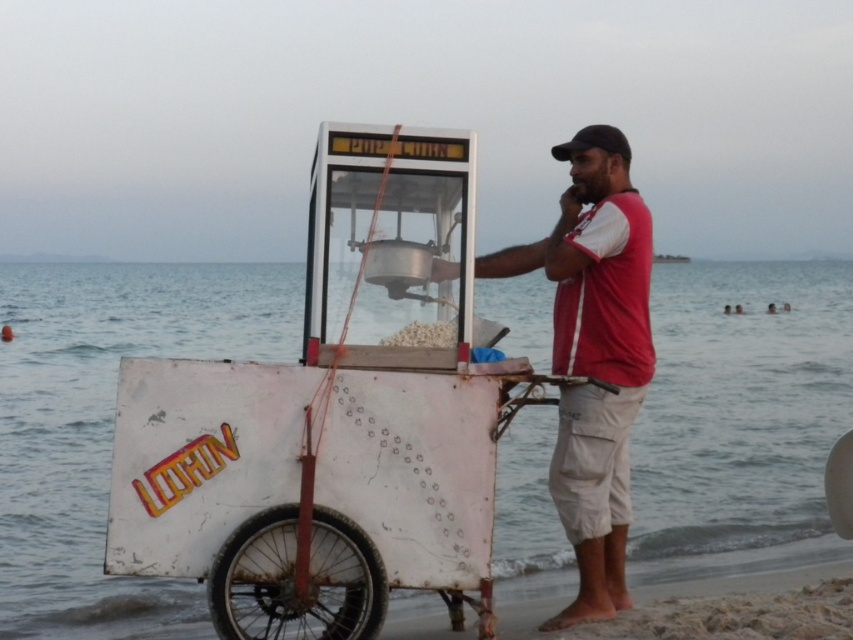
Question: Among these objects, which one is nearest to the camera?

Choices:
 (A) red cotton t-shirt at center
 (B) white matte popcorn cart at center

Answer: (B)

Question: Where is white matte popcorn cart at center located in relation to red cotton t-shirt at center in the image?

Choices:
 (A) above
 (B) below

Answer: (B)

Question: Does white matte popcorn cart at center have a greater width compared to red cotton t-shirt at center?

Choices:
 (A) yes
 (B) no

Answer: (B)

Question: From the image, what is the correct spatial relationship of white matte popcorn cart at center in relation to red cotton t-shirt at center?

Choices:
 (A) above
 (B) below

Answer: (B)

Question: Which object appears farthest from the camera in this image?

Choices:
 (A) white matte popcorn cart at center
 (B) red cotton t-shirt at center

Answer: (B)